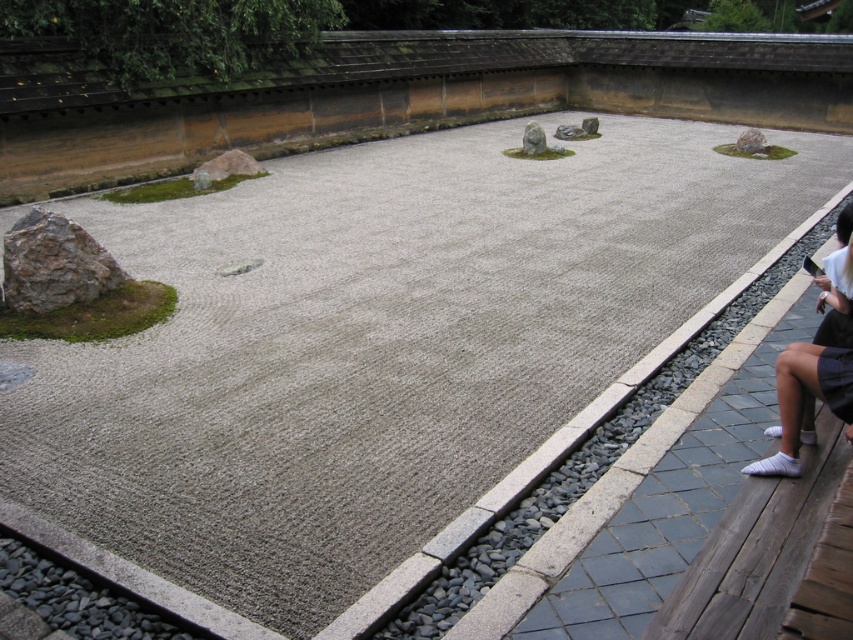
Question: Can you confirm if white fabric at right is bigger than rusty brown rock at left?

Choices:
 (A) yes
 (B) no

Answer: (A)

Question: Which of the following is the farthest from the observer?

Choices:
 (A) (78, 234)
 (B) (801, 417)

Answer: (A)

Question: Which object is closer to the camera taking this photo?

Choices:
 (A) white fabric at right
 (B) rusty brown rock at left

Answer: (A)

Question: Is white fabric at right smaller than rusty brown rock at left?

Choices:
 (A) no
 (B) yes

Answer: (A)

Question: From the image, what is the correct spatial relationship of white fabric at right in relation to rusty brown rock at left?

Choices:
 (A) right
 (B) left

Answer: (A)